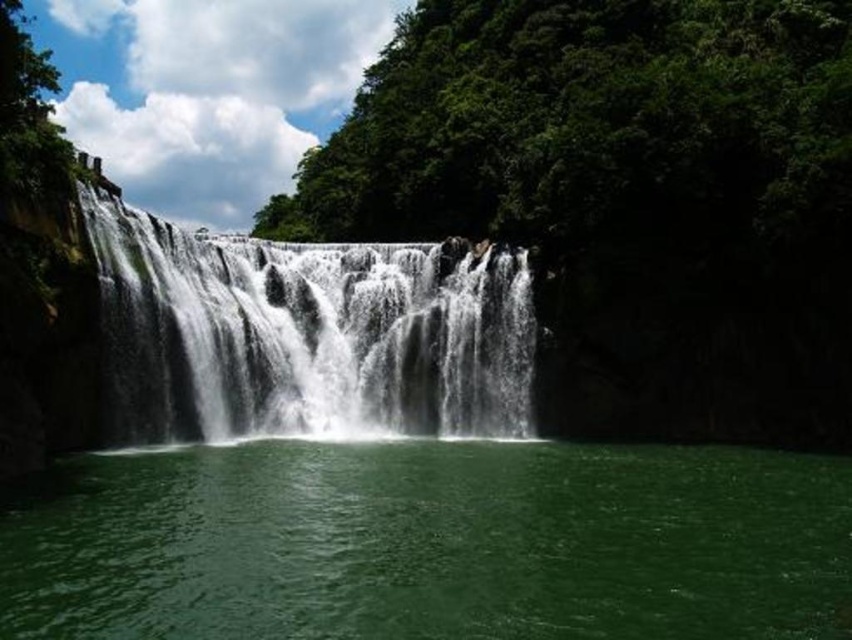
From the picture: You are a hiker who wants to cross the pool at the center of the waterfall area. You have a 10 feet wide inflatable raft. The white frothy water at center is too turbulent to walk through. Can your raft fit across the green liquid at center to cross safely?

The green liquid at center might be wider than white frothy water at center. Since the white frothy water at center is too turbulent to walk through, the raft can be placed on the green liquid at center if it is wide enough. However, the exact width isn

You are standing at the base of the waterfall and want to reach the point marked as point (629, 525). There is another point marked as point (413, 250). Which point is closer to you?

Point (629, 525) is closer to the viewer than point (413, 250).

You are a hiker who wants to collect water from the pool below the waterfall. You have a container that can hold up to 20 meters of water. Can you safely reach the green liquid at center without getting too close to the white frothy water at center?

The distance between the green liquid at center and the white frothy water at center is 22.83 meters. Since your container can hold up to 20 meters of water, you cannot safely reach the green liquid at center without getting closer than 20 meters to the white frothy water at center.